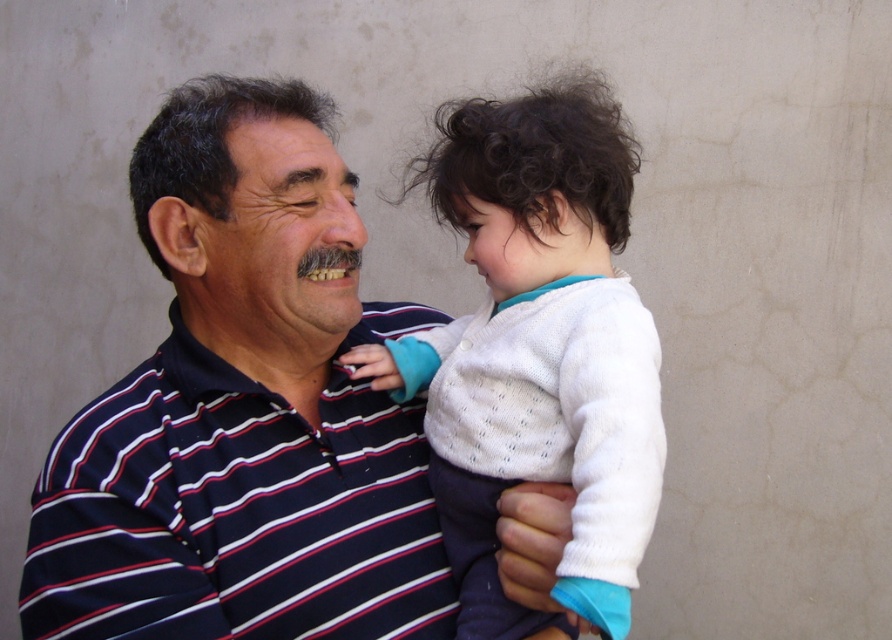
Between striped cotton shirt at center and white knit sweater at center, which one has less height?

striped cotton shirt at center

Find the location of a particular element. striped cotton shirt at center is located at coordinates (244, 410).

This screenshot has height=640, width=892. What do you see at coordinates (244, 410) in the screenshot?
I see `striped cotton shirt at center` at bounding box center [244, 410].

The height and width of the screenshot is (640, 892). In order to click on striped cotton shirt at center in this screenshot , I will do pos(244,410).